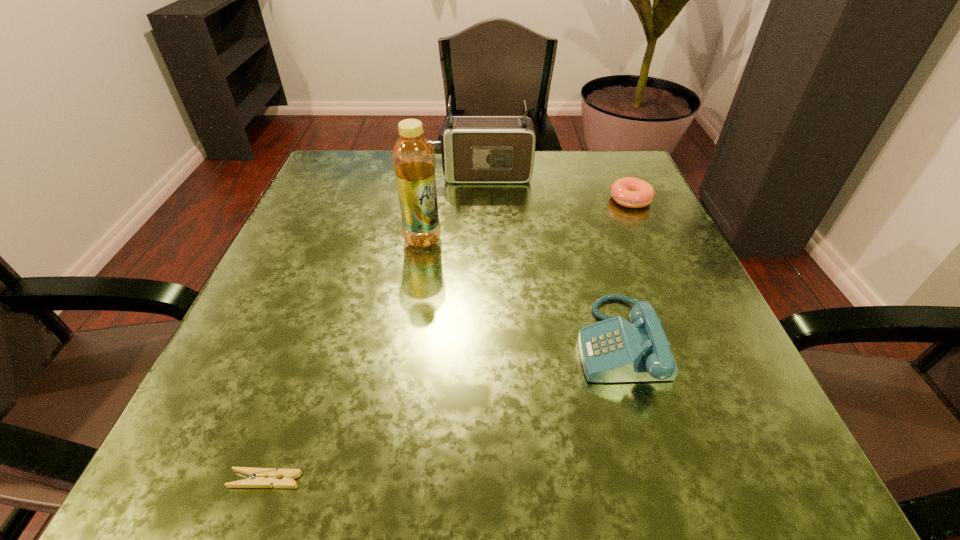
Where is `free region at the right edge of the desktop`? Image resolution: width=960 pixels, height=540 pixels. free region at the right edge of the desktop is located at coordinates (678, 245).

Identify the location of vacant space at the far left corner of the desktop. Image resolution: width=960 pixels, height=540 pixels. (382, 180).

Locate an element on the screen. The width and height of the screenshot is (960, 540). free space at the far right corner is located at coordinates (577, 170).

This screenshot has height=540, width=960. I want to click on vacant point at the near right corner, so click(690, 437).

Locate an element on the screen. free spot between the third tallest object and the bottle is located at coordinates (520, 291).

What are the coordinates of `vacant space that's between the rightmost object and the farthest object` in the screenshot? It's located at (556, 187).

Where is `vacant area between the camcorder and the bottle`? vacant area between the camcorder and the bottle is located at coordinates (452, 208).

This screenshot has width=960, height=540. I want to click on free area in between the fourth object from left to right and the nearest object, so click(x=442, y=411).

Identify the location of free area in between the tallest object and the camcorder. (452, 208).

The width and height of the screenshot is (960, 540). Find the location of `vacant space that is in between the third nearest object and the rightmost object`. vacant space that is in between the third nearest object and the rightmost object is located at coordinates [527, 220].